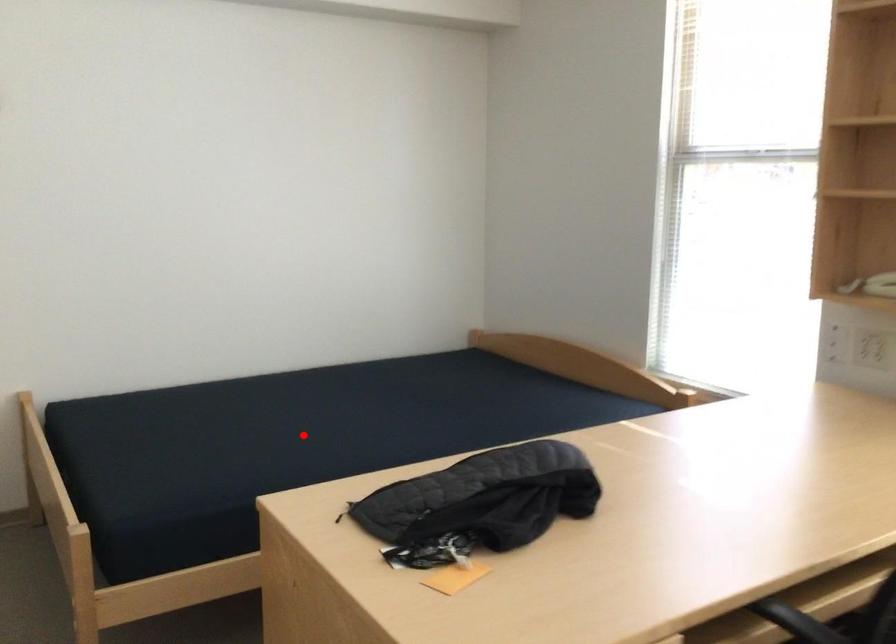
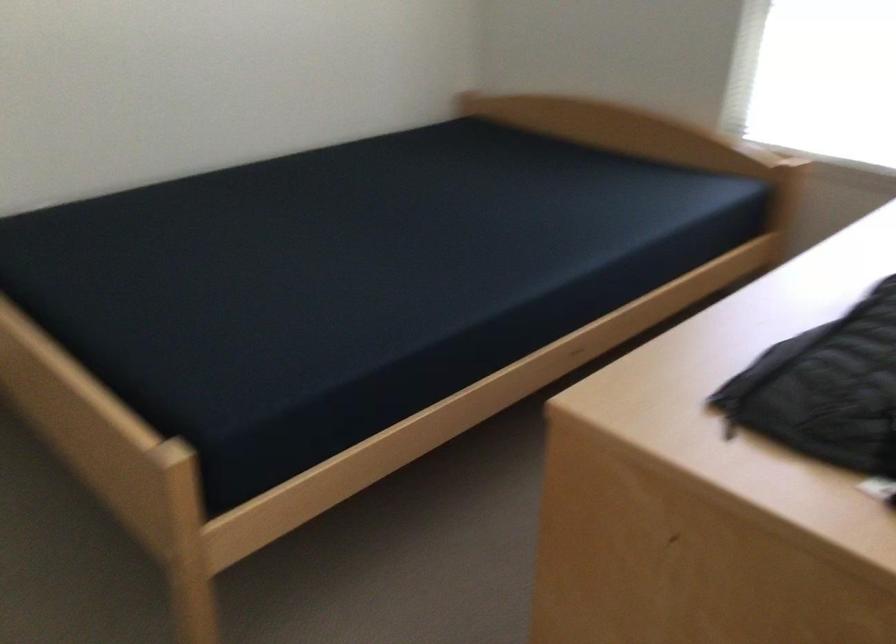
Question: I am providing you with two images of the same scene from different viewpoints. Image1 has a red point marked. In image2, the corresponding 3D location appears at what relative position? Reply with the corresponding letter.

Choices:
 (A) Closer
 (B) Farther

Answer: (A)